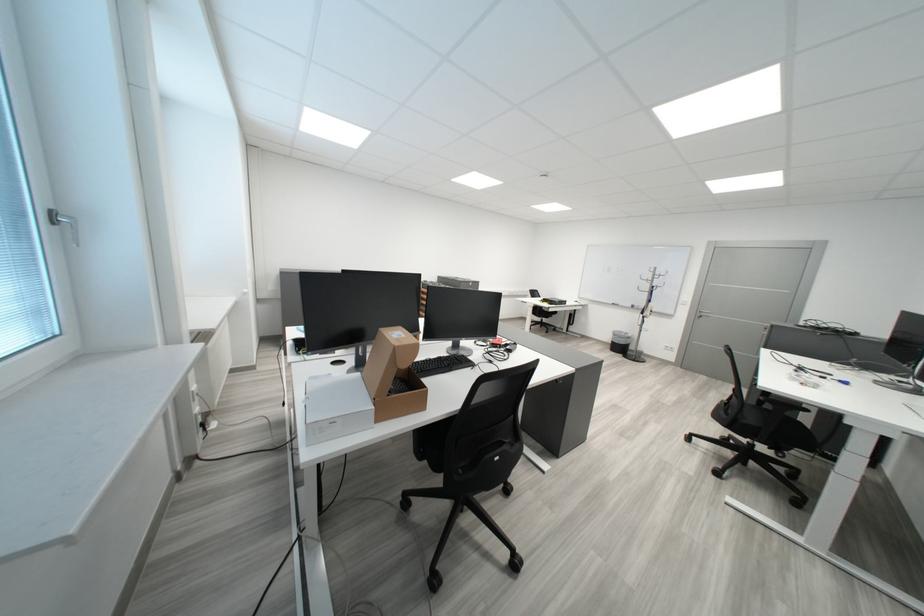
Image resolution: width=924 pixels, height=616 pixels. Describe the element at coordinates (801, 410) in the screenshot. I see `the chair armrest` at that location.